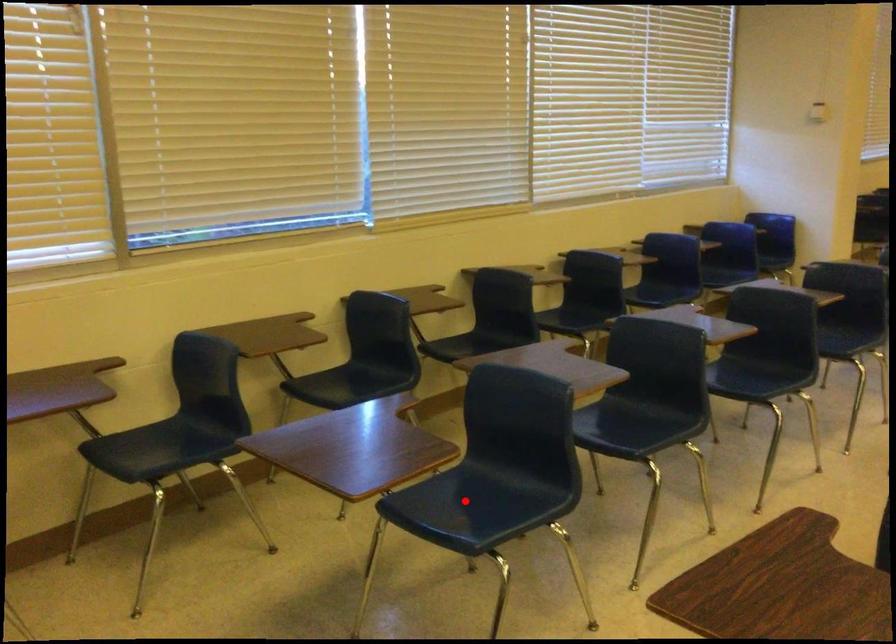
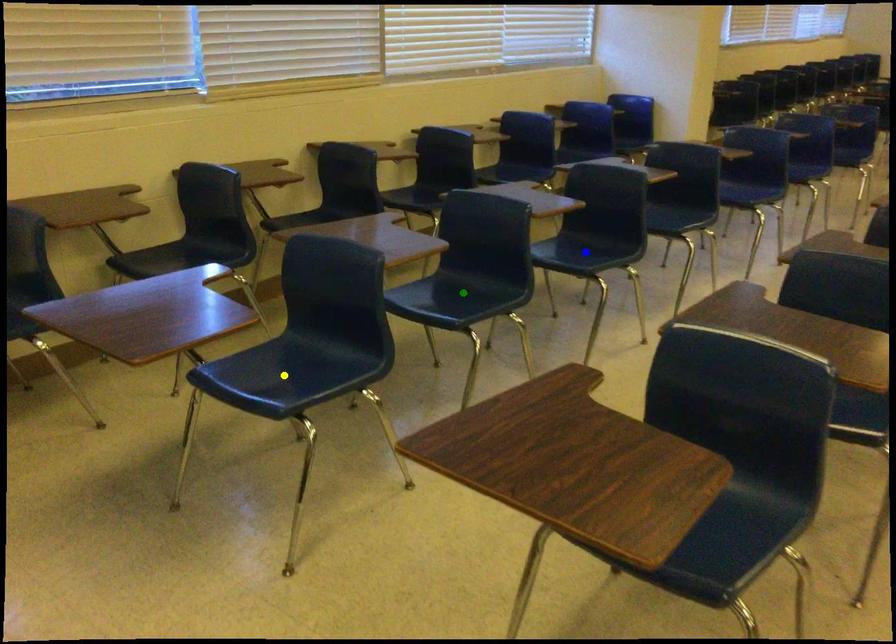
Question: I am providing you with two images of the same scene from different viewpoints. A red point is marked on the first image. You are given multiple points on the second image. In image 2, which mark is for the same physical point as the one in image 1?

Choices:
 (A) yellow point
 (B) blue point
 (C) green point

Answer: (A)